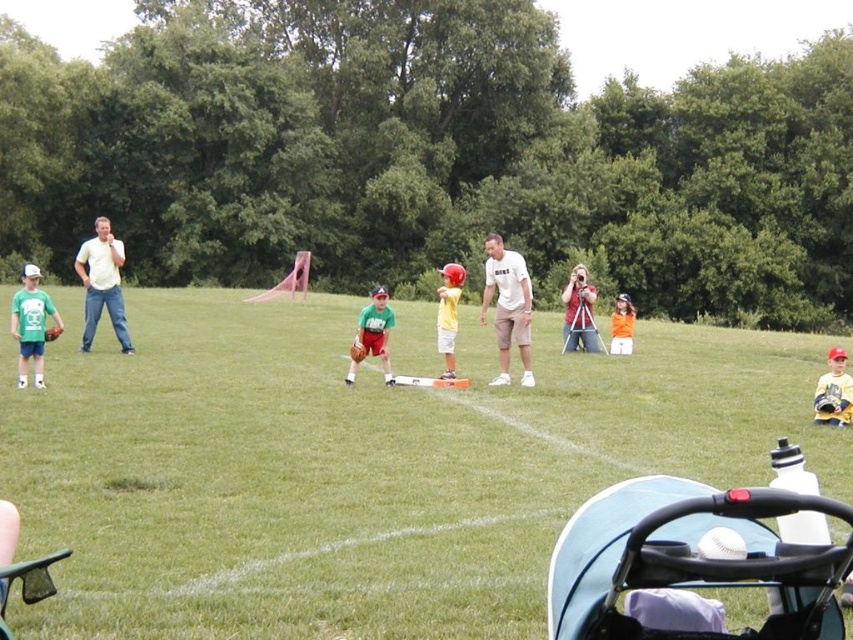
Question: Which of the following is the closest to the observer?

Choices:
 (A) (843, 371)
 (B) (514, 280)
 (C) (817, 442)
 (D) (582, 330)

Answer: (C)

Question: Among these objects, which one is nearest to the camera?

Choices:
 (A) orange matte shirt at center
 (B) yellow matte baseball bat at center
 (C) green grass at center
 (D) matte yellow baseball glove at center

Answer: (C)

Question: Does matte green t-shirt at left lie behind yellow matte baseball bat at center?

Choices:
 (A) no
 (B) yes

Answer: (A)

Question: Is green grass at center above green matte baseball glove at center?

Choices:
 (A) no
 (B) yes

Answer: (A)

Question: Does white matte shirt at left appear under matte green t-shirt at left?

Choices:
 (A) yes
 (B) no

Answer: (B)

Question: Which object is positioned closest to the white cotton shirt at center?

Choices:
 (A) matte green t-shirt at left
 (B) orange matte shirt at center
 (C) matte white camera at center

Answer: (C)